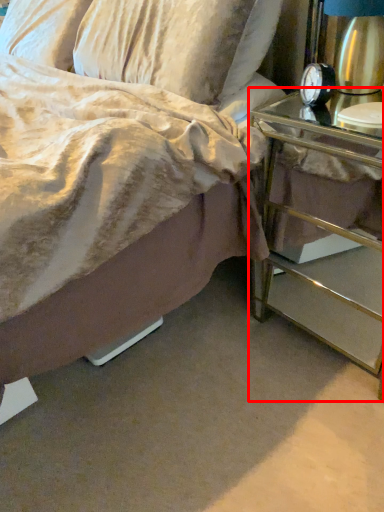
Question: Where is nightstand (annotated by the red box) located in relation to alarm clock in the image?

Choices:
 (A) right
 (B) left

Answer: (A)